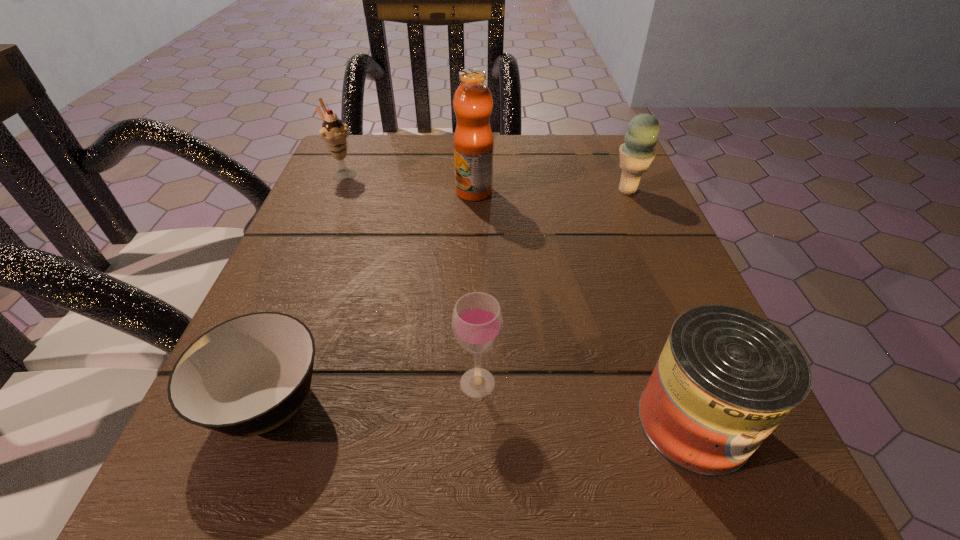
At what (x,y) coordinates should I click in order to perform the action: click on vacant region located on the back of the can. Please return your answer as a coordinate pair (x, y). The width and height of the screenshot is (960, 540). Looking at the image, I should click on (643, 288).

Identify the location of free space located on the back of the shortest object. (306, 303).

Locate an element on the screen. Image resolution: width=960 pixels, height=540 pixels. fruit juice located at the far edge is located at coordinates (473, 140).

The height and width of the screenshot is (540, 960). What are the coordinates of `can present at the near edge` in the screenshot? It's located at (726, 378).

Locate an element on the screen. This screenshot has width=960, height=540. soup bowl at the near edge is located at coordinates (248, 375).

Identify the location of icecream present at the left edge. Image resolution: width=960 pixels, height=540 pixels. (x=334, y=132).

The height and width of the screenshot is (540, 960). What are the coordinates of `soup bowl present at the left edge` in the screenshot? It's located at (248, 375).

This screenshot has width=960, height=540. Find the location of `ice cream present at the right edge`. ice cream present at the right edge is located at coordinates (636, 154).

I want to click on can that is at the right edge, so click(x=726, y=378).

Find the location of a particular element. The width and height of the screenshot is (960, 540). object at the far left corner is located at coordinates (334, 132).